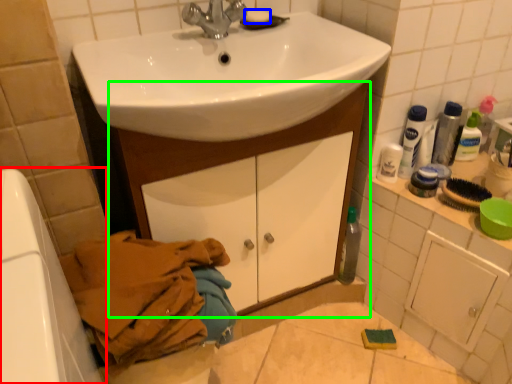
Question: Considering the real-world distances, which object is closest to bath (highlighted by a red box)? soap (highlighted by a blue box) or bathroom cabinet (highlighted by a green box).

Choices:
 (A) soap
 (B) bathroom cabinet

Answer: (B)